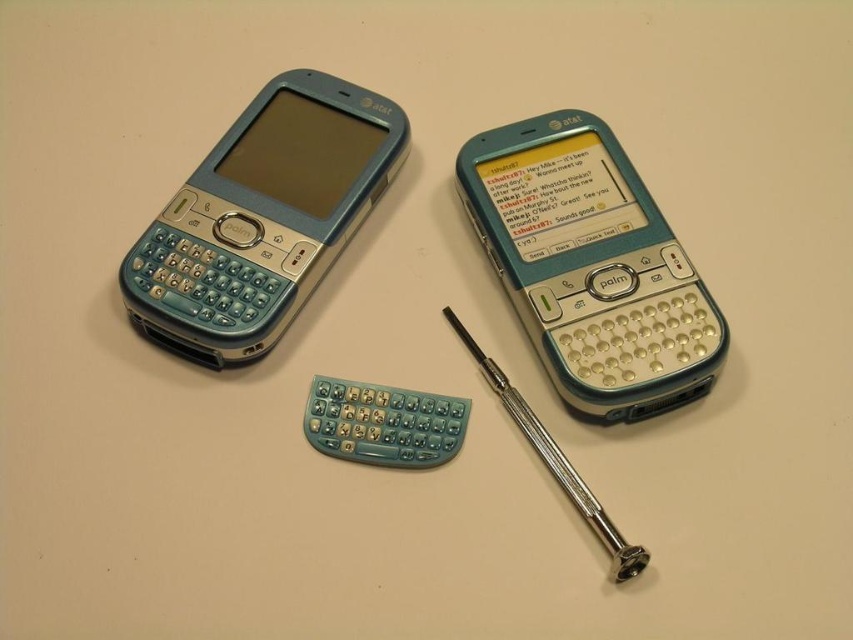
Does teal plastic smartphone at center have a greater height compared to teal plastic keyboard at left?

Indeed, teal plastic smartphone at center has a greater height compared to teal plastic keyboard at left.

Between teal plastic smartphone at center and teal plastic keyboard at left, which one appears on the left side from the viewer's perspective?

teal plastic keyboard at left is more to the left.

The image size is (853, 640). What do you see at coordinates (590, 266) in the screenshot? I see `teal plastic smartphone at center` at bounding box center [590, 266].

Identify the location of teal plastic smartphone at center. (590, 266).